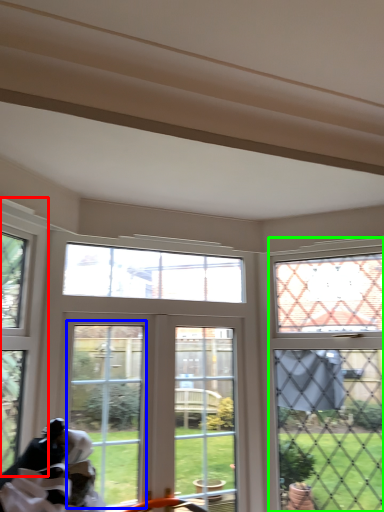
Question: Which is farther away from window (highlighted by a red box)? screen door (highlighted by a blue box) or window (highlighted by a green box)?

Choices:
 (A) screen door
 (B) window

Answer: (B)